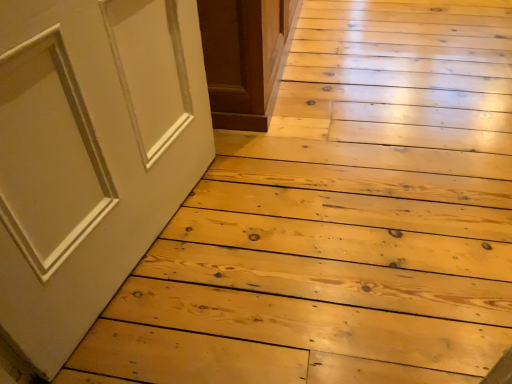
Where is `vacant space in white painted wood door at left (from a real-world perspective)`? vacant space in white painted wood door at left (from a real-world perspective) is located at coordinates (151, 251).